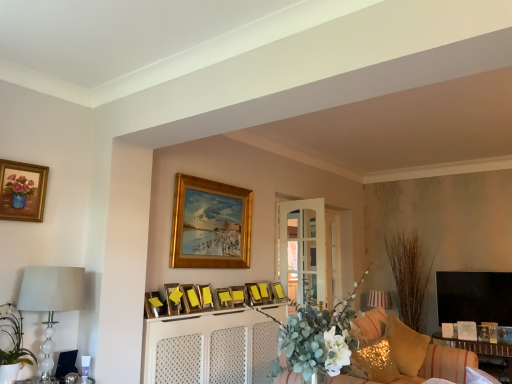
Question: From the image's perspective, is matte yellow picture frame at center, which is the seventh picture frame from left to right, below matte gold picture frame at upper left, the 11th picture frame viewed from the right?

Choices:
 (A) no
 (B) yes

Answer: (B)

Question: Considering the relative sizes of matte yellow picture frame at center, positioned as the 5th picture frame in right-to-left order, and matte gold picture frame at upper left, the 1th picture frame viewed from the left, in the image provided, is matte yellow picture frame at center, positioned as the 5th picture frame in right-to-left order, bigger than matte gold picture frame at upper left, the 1th picture frame viewed from the left,?

Choices:
 (A) no
 (B) yes

Answer: (A)

Question: Is matte yellow picture frame at center, which is the seventh picture frame from left to right, next to matte gold picture frame at upper left, the 1th picture frame viewed from the left, and touching it?

Choices:
 (A) yes
 (B) no

Answer: (B)

Question: From a real-world perspective, is matte yellow picture frame at center, which is the seventh picture frame from left to right, physically above matte gold picture frame at upper left, the 11th picture frame viewed from the right?

Choices:
 (A) no
 (B) yes

Answer: (A)

Question: Can you confirm if matte yellow picture frame at center, positioned as the 5th picture frame in right-to-left order, is wider than matte gold picture frame at upper left, the 1th picture frame viewed from the left?

Choices:
 (A) no
 (B) yes

Answer: (B)

Question: From a real-world perspective, does matte yellow picture frame at center, positioned as the 5th picture frame in right-to-left order, sit lower than matte gold picture frame at upper left, the 11th picture frame viewed from the right?

Choices:
 (A) yes
 (B) no

Answer: (A)

Question: From a real-world perspective, is white glass lamp at left, marked as the 1th lamp in a front-to-back arrangement, over matte gold picture frame at upper left, the 1th picture frame viewed from the left?

Choices:
 (A) no
 (B) yes

Answer: (A)

Question: Is white glass lamp at left, positioned as the 2th lamp in back-to-front order, beside matte gold picture frame at upper left, the 11th picture frame viewed from the right?

Choices:
 (A) no
 (B) yes

Answer: (A)

Question: Is white glass lamp at left, the 1th lamp positioned from the left, facing towards matte gold picture frame at upper left, the 11th picture frame viewed from the right?

Choices:
 (A) yes
 (B) no

Answer: (B)

Question: Does white glass lamp at left, which appears as the second lamp when viewed from the right, have a smaller size compared to matte gold picture frame at upper left, the 1th picture frame viewed from the left?

Choices:
 (A) yes
 (B) no

Answer: (B)

Question: Does white glass lamp at left, acting as the 1th lamp starting from the top, have a greater width compared to matte gold picture frame at upper left, the 11th picture frame viewed from the right?

Choices:
 (A) no
 (B) yes

Answer: (B)

Question: Is white glass lamp at left, arranged as the 2th lamp when ordered from the bottom, not close to matte gold picture frame at upper left, the 11th picture frame viewed from the right?

Choices:
 (A) no
 (B) yes

Answer: (A)

Question: Is wooden picture frame at center, marked as the 8th picture frame in a left-to-right arrangement, far from wooden picture frame at center, the 2th picture frame viewed from the right?

Choices:
 (A) no
 (B) yes

Answer: (A)